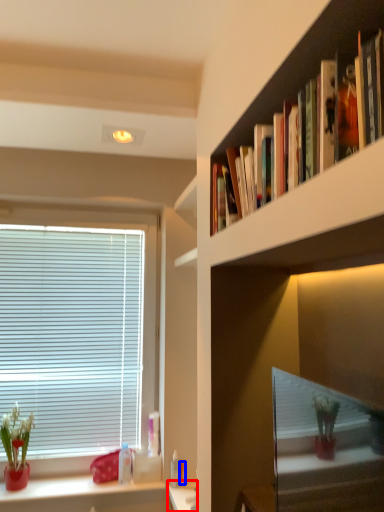
Question: Which object is further to the camera taking this photo, vanity (highlighted by a red box) or toiletry (highlighted by a blue box)?

Choices:
 (A) vanity
 (B) toiletry

Answer: (B)